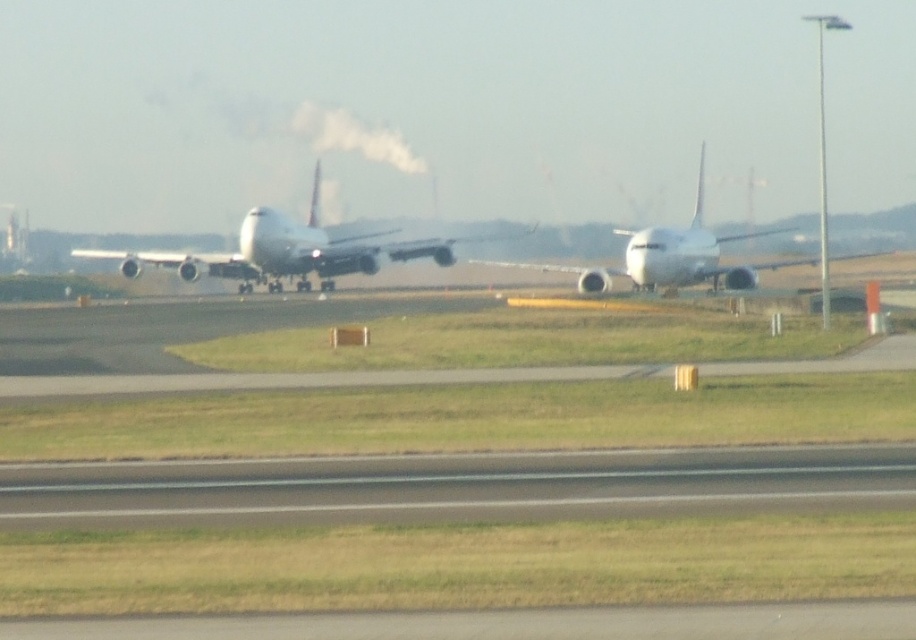
You are a pilot preparing to taxi your plane to the runway. You see two planes ahead, the white matte airplane at center and the white glossy airplane at center. Which one is closer to the left side of the runway?

The white matte airplane at center is positioned on the left side of the white glossy airplane at center, so it is closer to the left side of the runway.

You are a pilot preparing for takeoff and need to align your plane with the runway markers. The runway markers are located at coordinates 0.394, 0.317. Is your current position, which is the white matte airplane at center, aligned with the markers?

The white matte airplane at center is positioned at point (289,252), so it is aligned with the runway markers located at those coordinates.